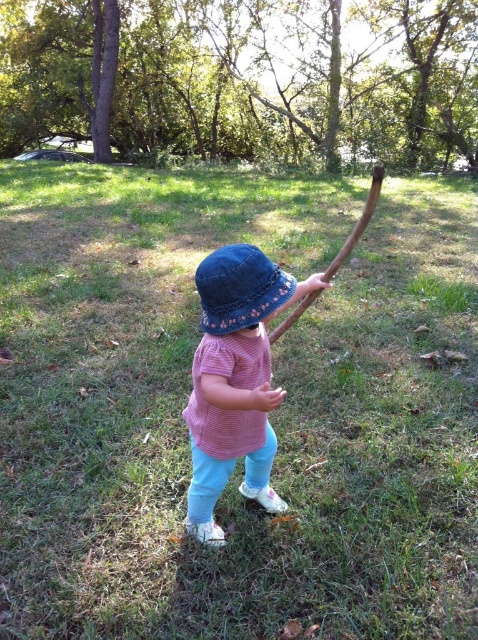
Question: From the image, what is the correct spatial relationship of pink striped shirt at center in relation to denim hat at center?

Choices:
 (A) right
 (B) left

Answer: (B)

Question: Does pink striped shirt at center have a greater width compared to denim hat at center?

Choices:
 (A) no
 (B) yes

Answer: (B)

Question: Which point appears closest to the camera in this image?

Choices:
 (A) (229, 282)
 (B) (218, 301)

Answer: (A)

Question: Where is pink striped shirt at center located in relation to denim hat at center in the image?

Choices:
 (A) right
 (B) left

Answer: (B)

Question: Which of the following is the closest to the observer?

Choices:
 (A) denim hat at center
 (B) pink striped shirt at center

Answer: (B)